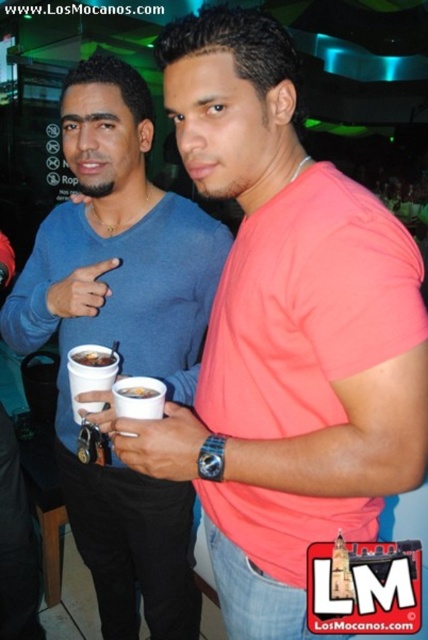
You are at a party and need to grab a drink quickly. You see the blue matte shirt at center and the white matte cup at center. Which one should you reach for if you want to get the cup without disturbing the shirt?

The white matte cup at center is above the blue matte shirt at center, so you should reach for the white matte cup at center directly without disturbing the shirt.

You are at a party and need to place the white matte cup at center on top of the blue matte shirt at center. Is this possible based on their sizes?

The blue matte shirt at center has a greater height compared to the white matte cup at center, so placing the white matte cup at center on top of the blue matte shirt at center is possible since the shirt is taller.